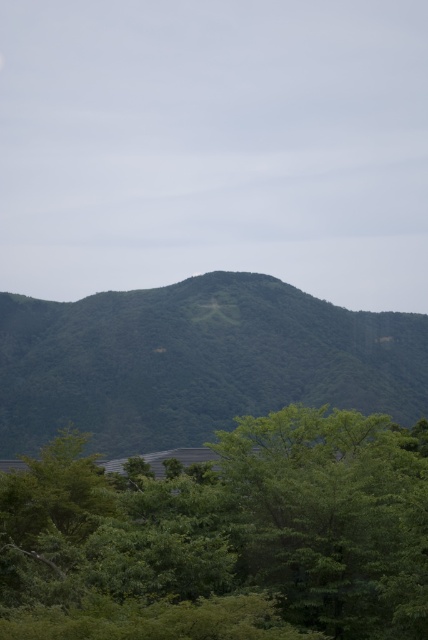
Question: Does green leafy tree at lower center have a lesser width compared to green leafy mountain at center?

Choices:
 (A) yes
 (B) no

Answer: (A)

Question: Among these objects, which one is farthest from the camera?

Choices:
 (A) green leafy tree at lower center
 (B) green leafy mountain at center

Answer: (B)

Question: Does green leafy tree at lower center have a greater width compared to green leafy mountain at center?

Choices:
 (A) no
 (B) yes

Answer: (A)

Question: Which point is closer to the camera?

Choices:
 (A) green leafy mountain at center
 (B) green leafy tree at lower center

Answer: (B)

Question: Does green leafy tree at lower center come behind green leafy mountain at center?

Choices:
 (A) yes
 (B) no

Answer: (B)

Question: Which point is farther from the camera taking this photo?

Choices:
 (A) (17, 404)
 (B) (383, 593)

Answer: (A)